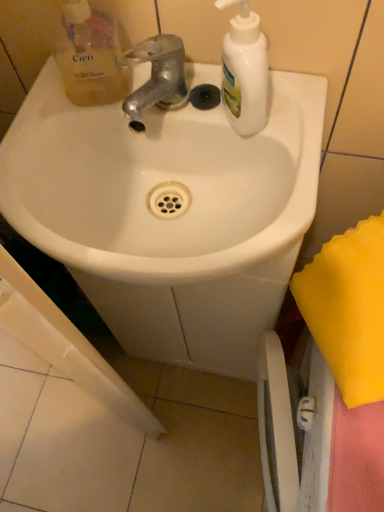
Question: Is shiny metallic faucet at center positioned with its back to white glossy sink at center?

Choices:
 (A) yes
 (B) no

Answer: (B)

Question: Does shiny metallic faucet at center have a greater width compared to white glossy sink at center?

Choices:
 (A) no
 (B) yes

Answer: (A)

Question: Is shiny metallic faucet at center not close to white glossy sink at center?

Choices:
 (A) yes
 (B) no

Answer: (B)

Question: Is shiny metallic faucet at center with white glossy sink at center?

Choices:
 (A) no
 (B) yes

Answer: (A)

Question: From a real-world perspective, is shiny metallic faucet at center over white glossy sink at center?

Choices:
 (A) yes
 (B) no

Answer: (A)

Question: Does shiny metallic faucet at center turn towards white glossy sink at center?

Choices:
 (A) yes
 (B) no

Answer: (B)

Question: Does shiny metallic faucet at center have a lesser width compared to white matte bottle at upper right?

Choices:
 (A) no
 (B) yes

Answer: (A)

Question: Considering the relative sizes of shiny metallic faucet at center and white matte bottle at upper right in the image provided, is shiny metallic faucet at center taller than white matte bottle at upper right?

Choices:
 (A) yes
 (B) no

Answer: (B)

Question: Is white matte bottle at upper right surrounded by shiny metallic faucet at center?

Choices:
 (A) yes
 (B) no

Answer: (B)

Question: From the image's perspective, is shiny metallic faucet at center located above white matte bottle at upper right?

Choices:
 (A) yes
 (B) no

Answer: (A)

Question: From a real-world perspective, is shiny metallic faucet at center physically above white matte bottle at upper right?

Choices:
 (A) yes
 (B) no

Answer: (B)

Question: Is shiny metallic faucet at center positioned beyond the bounds of white matte bottle at upper right?

Choices:
 (A) yes
 (B) no

Answer: (A)

Question: Is translucent yellow liquid soap at upper left a part of shiny metallic faucet at center?

Choices:
 (A) no
 (B) yes

Answer: (A)